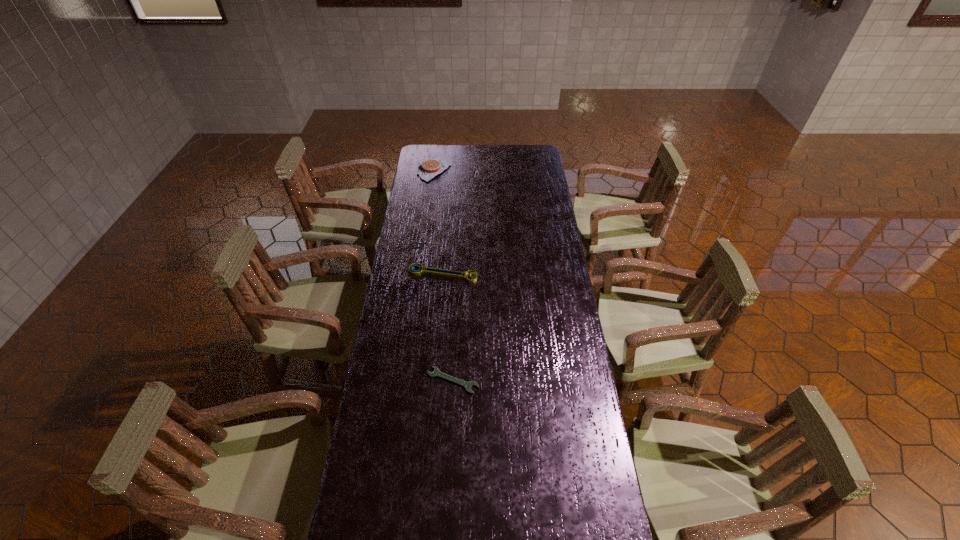
This screenshot has width=960, height=540. What are the coordinates of `pie` in the screenshot? It's located at (430, 168).

I want to click on the tallest object, so click(x=430, y=168).

Locate an element on the screen. the taller wrench is located at coordinates (428, 270).

Locate an element on the screen. Image resolution: width=960 pixels, height=540 pixels. the second shortest object is located at coordinates (428, 270).

Identify the location of the shorter wrench. Image resolution: width=960 pixels, height=540 pixels. (436, 373).

The image size is (960, 540). What are the coordinates of `the nearer wrench` in the screenshot? It's located at (436, 373).

This screenshot has height=540, width=960. Find the location of `free location located 0.100m on the right of the pie`. free location located 0.100m on the right of the pie is located at coordinates (469, 170).

What are the coordinates of `blank area located on the right of the taller wrench` in the screenshot? It's located at (539, 273).

At what (x,y) coordinates should I click in order to perform the action: click on free space located on the back of the nearer wrench. Please return your answer as a coordinate pair (x, y). Image resolution: width=960 pixels, height=540 pixels. Looking at the image, I should click on (455, 335).

At what (x,y) coordinates should I click in order to perform the action: click on object that is positioned at the far edge. Please return your answer as a coordinate pair (x, y). This screenshot has height=540, width=960. Looking at the image, I should click on tap(430, 168).